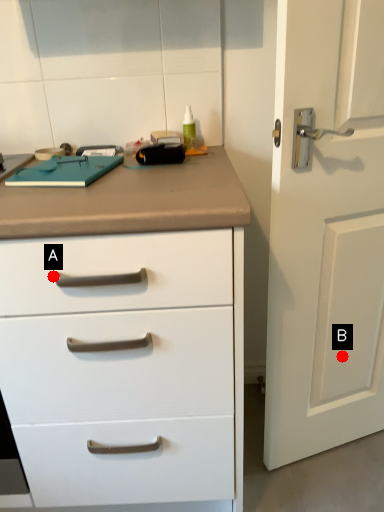
Question: Two points are circled on the image, labeled by A and B beside each circle. Which point is closer to the camera taking this photo?

Choices:
 (A) A is closer
 (B) B is closer

Answer: (A)